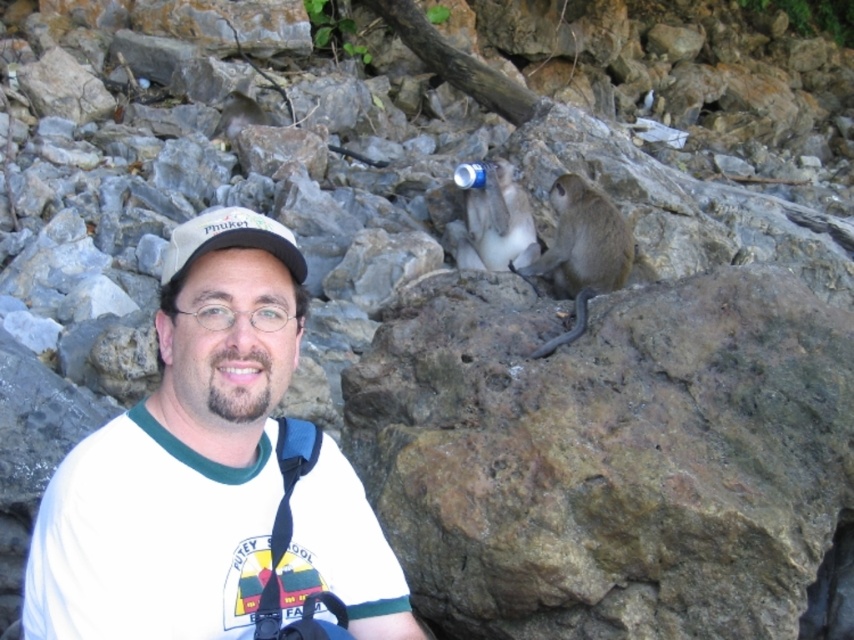
Question: Which point is closer to the camera?

Choices:
 (A) blue plastic bottle at upper center
 (B) white fabric cap at left

Answer: (B)

Question: Is brown rough rock at center below brown furry monkey at center?

Choices:
 (A) no
 (B) yes

Answer: (B)

Question: Which point is farther from the camera taking this photo?

Choices:
 (A) (200, 372)
 (B) (191, 248)
 (C) (738, 518)
 (D) (515, 192)

Answer: (D)

Question: Is white cotton shirt at left above gray furry monkey at upper center?

Choices:
 (A) no
 (B) yes

Answer: (A)

Question: Estimate the real-world distances between objects in this image. Which object is farther from the brown rough rock at center?

Choices:
 (A) white fabric cap at left
 (B) brown furry monkey at center

Answer: (B)

Question: Is gray furry monkey at upper center smaller than white fabric cap at left?

Choices:
 (A) no
 (B) yes

Answer: (A)